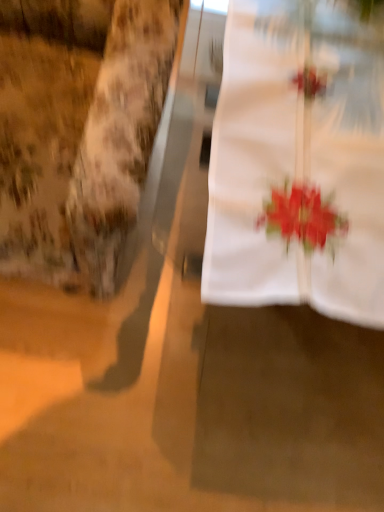
Describe the element at coordinates (298, 162) in the screenshot. The image size is (384, 512). I see `white embroidered cloth at center` at that location.

The height and width of the screenshot is (512, 384). I want to click on white embroidered cloth at center, so click(x=298, y=162).

Measure the distance between white embroidered cloth at center and camera.

22.20 inches.

At what (x,y) coordinates should I click in order to perform the action: click on white embroidered cloth at center. Please return your answer as a coordinate pair (x, y). This screenshot has width=384, height=512. Looking at the image, I should click on (298, 162).